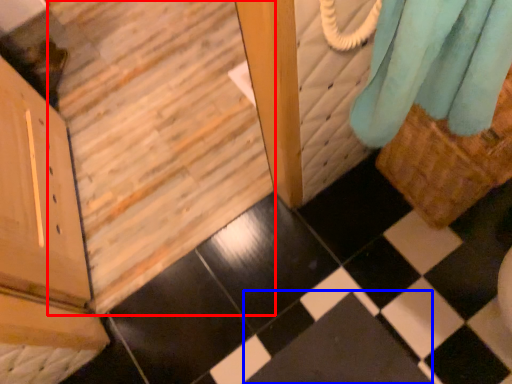
Question: Which point is further to the camera, stairwell (highlighted by a red box) or square (highlighted by a blue box)?

Choices:
 (A) stairwell
 (B) square

Answer: (B)